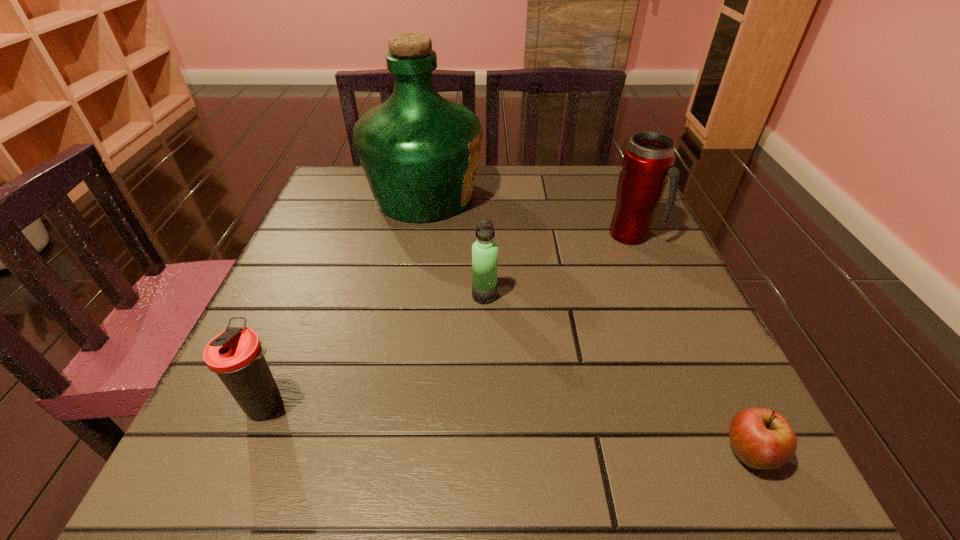
Identify the location of vacant space that satisfies the following two spatial constraints: 1. on the label side of the tallest object; 2. on the back side of the apple. Image resolution: width=960 pixels, height=540 pixels. coord(379,454).

This screenshot has width=960, height=540. I want to click on free location that satisfies the following two spatial constraints: 1. on the label side of the tallest object; 2. on the back side of the shortest object, so (x=379, y=454).

Find the location of a particular element. vacant area in the image that satisfies the following two spatial constraints: 1. on the label side of the liquor; 2. on the left side of the nearest object is located at coordinates (379, 454).

Locate an element on the screen. This screenshot has width=960, height=540. free space that satisfies the following two spatial constraints: 1. on the side with the handle of the apple; 2. on the right side of the tallest thermos bottle is located at coordinates pyautogui.click(x=725, y=454).

Find the location of `free spot that satisfies the following two spatial constraints: 1. on the label side of the apple; 2. on the left side of the tallest object`. free spot that satisfies the following two spatial constraints: 1. on the label side of the apple; 2. on the left side of the tallest object is located at coordinates (379, 454).